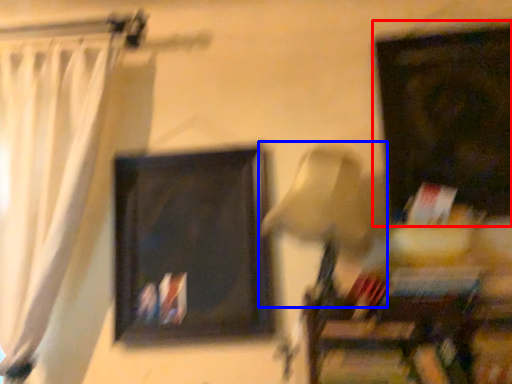
Question: Which of the following is the farthest to the observer, picture frame (highlighted by a red box) or table lamp (highlighted by a blue box)?

Choices:
 (A) picture frame
 (B) table lamp

Answer: (A)